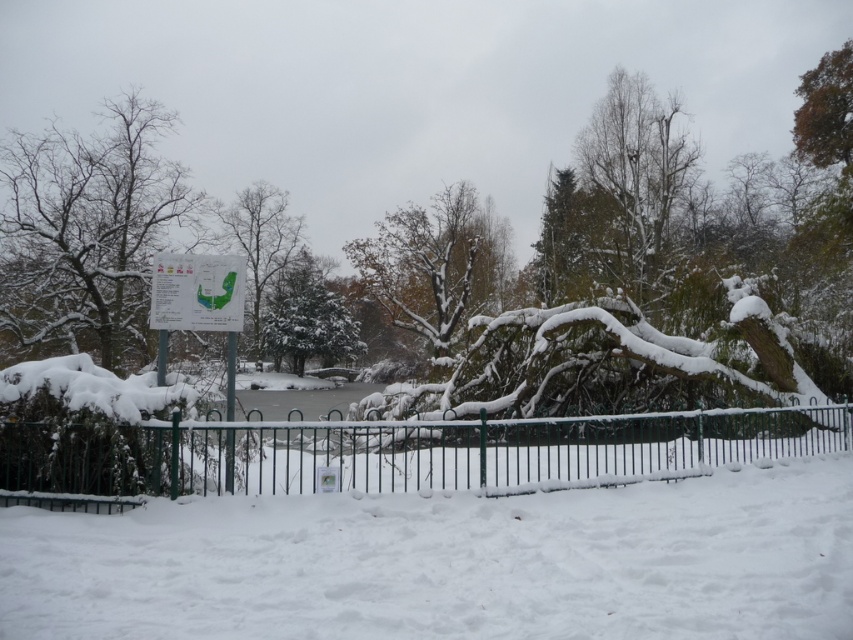
You are a snowplow operator trying to clear the snow at the park. You need to determine which area requires more effort based on their heights. Which has a greater height, the white fluffy snow at lower center or the green metal fence at center?

Answer: The green metal fence at center has a greater height than the white fluffy snow at lower center according to the description.

You are standing in the winter scene and want to take a photo of both point (409, 259) and point (300, 253). Which point will appear larger in your photo?

Point (409, 259) is closer to the camera than point (300, 253), so it will appear larger in the photo.